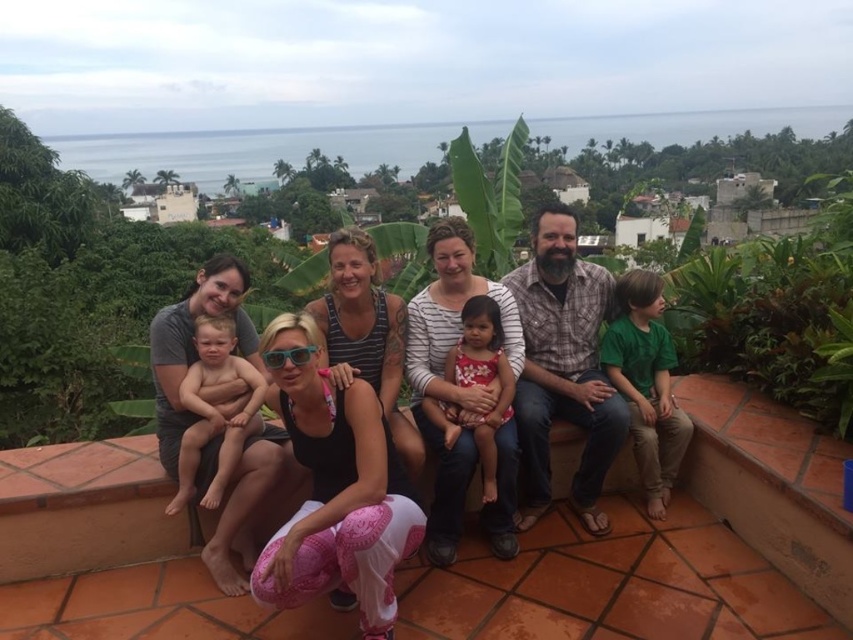
Question: Considering the real-world distances, which object is closest to the matte black tank top at center?

Choices:
 (A) floral fabric dress at center
 (B) smooth skin baby at center
 (C) pink crochet pants at center
 (D) green cotton shirt at right

Answer: (A)

Question: Which object is positioned farthest from the matte black tank top at center?

Choices:
 (A) green cotton shirt at right
 (B) pink crochet pants at center

Answer: (B)

Question: Which point is closer to the camera taking this photo?

Choices:
 (A) (575, 458)
 (B) (227, 344)
 (C) (653, 358)
 (D) (282, 364)

Answer: (D)

Question: Is matte black tank top at center bigger than pink crochet pants at center?

Choices:
 (A) yes
 (B) no

Answer: (A)

Question: Can you confirm if green cotton shirt at right is positioned to the left of smooth skin baby at center?

Choices:
 (A) no
 (B) yes

Answer: (A)

Question: Is pink crochet pants at center to the right of floral fabric dress at center from the viewer's perspective?

Choices:
 (A) no
 (B) yes

Answer: (A)